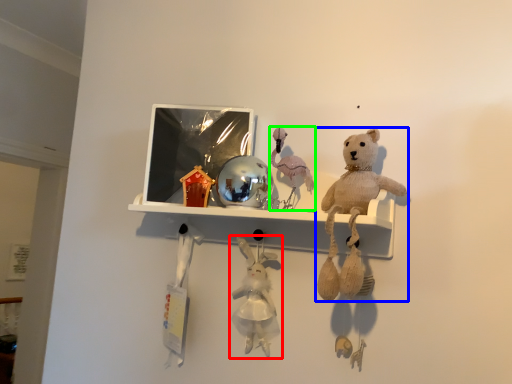
Question: Which object is positioned farthest from toy (highlighted by a red box)? Select from teddy bear (highlighted by a blue box) and toy (highlighted by a green box).

Choices:
 (A) teddy bear
 (B) toy

Answer: (A)